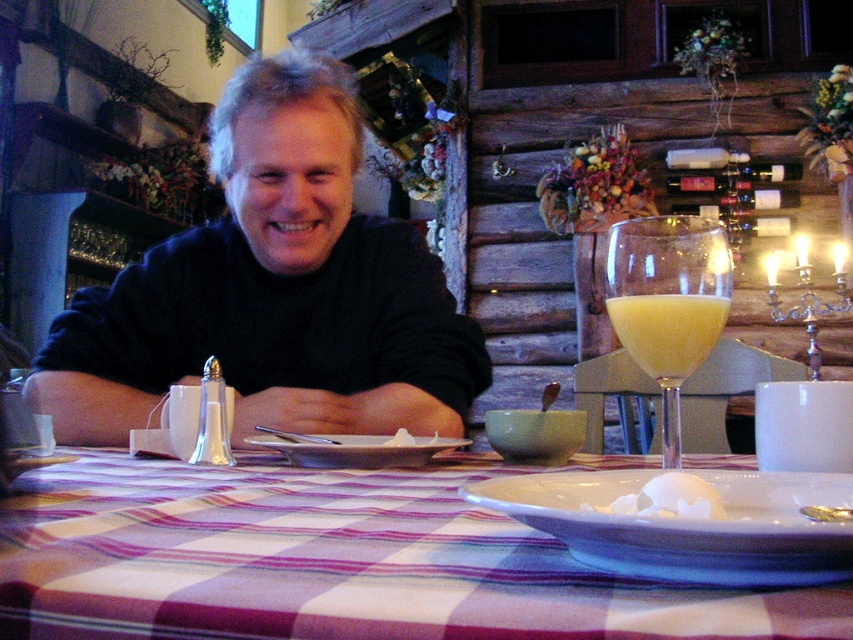
Is yellow translucent wine glass at right smaller than white matte plate at center?

No, yellow translucent wine glass at right is not smaller than white matte plate at center.

Does yellow translucent wine glass at right appear on the left side of white matte plate at center?

In fact, yellow translucent wine glass at right is to the right of white matte plate at center.

Between point (648, 259) and point (262, 435), which one is positioned in front?

Point (648, 259) is in front.

You are a GUI agent. You are given a task and a screenshot of the screen. Output one action in this format:
    pyautogui.click(x=<x>, y=<y>)
    Task: Click on the yellow translucent wine glass at right
    
    Given the screenshot: What is the action you would take?
    pyautogui.click(x=668, y=301)

Is plaid fabric at center taller than white matte plate at center?

Yes.

Is point (466, 621) farther from camera compared to point (409, 458)?

No, (466, 621) is closer to viewer.

Is point (543, 563) closer to viewer compared to point (316, 449)?

That is True.

The width and height of the screenshot is (853, 640). Find the location of `plaid fabric at center`. plaid fabric at center is located at coordinates (335, 560).

Is white matte plate at center smaller than white creamy egg at center?

No, white matte plate at center is not smaller than white creamy egg at center.

Does white matte plate at center come in front of white creamy egg at center?

No, it is behind white creamy egg at center.

Describe the element at coordinates (357, 451) in the screenshot. This screenshot has width=853, height=640. I see `white matte plate at center` at that location.

Locate an element on the screen. white matte plate at center is located at coordinates (357, 451).